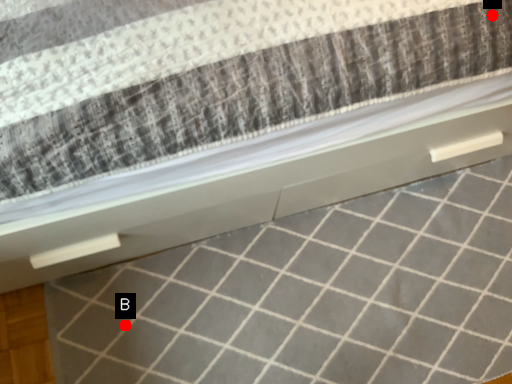
Question: Two points are circled on the image, labeled by A and B beside each circle. Which point is closer to the camera?

Choices:
 (A) A is closer
 (B) B is closer

Answer: (A)